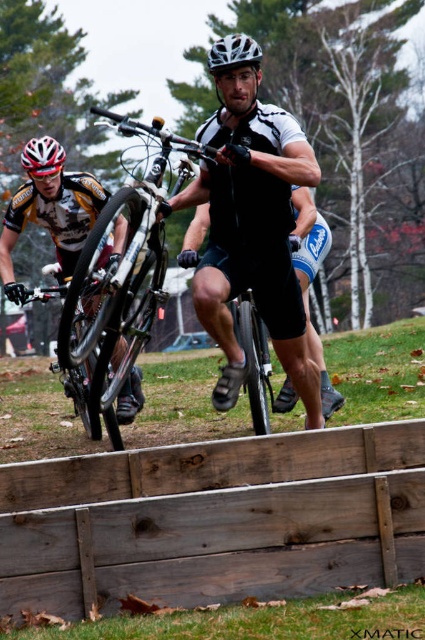
Is point (133, 218) closer to viewer compared to point (42, 154)?

Yes, point (133, 218) is in front of point (42, 154).

Find the location of `silver metallic mountain bike at center`. silver metallic mountain bike at center is located at coordinates (119, 275).

Where is `silver metallic mountain bike at center`? This screenshot has width=425, height=640. silver metallic mountain bike at center is located at coordinates tap(119, 275).

Is silver metallic mountain bike at center to the left of shiny silver bicycle at center from the viewer's perspective?

No, silver metallic mountain bike at center is not to the left of shiny silver bicycle at center.

Between silver metallic mountain bike at center and shiny silver bicycle at center, which one is positioned higher?

silver metallic mountain bike at center

Which is in front, point (136, 202) or point (96, 381)?

Point (136, 202) is in front.

What are the coordinates of `silver metallic mountain bike at center` in the screenshot? It's located at (119, 275).

Based on the photo, does white matte helmet at center appear on the right side of white matte bicycle helmet at upper left?

Indeed, white matte helmet at center is positioned on the right side of white matte bicycle helmet at upper left.

Find the location of `white matte helmet at center`. white matte helmet at center is located at coordinates (234, 52).